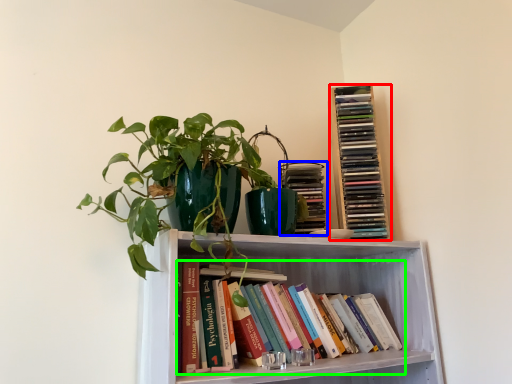
Question: Estimate the real-world distances between objects in this image. Which object is farther from book (highlighted by a red box), book (highlighted by a blue box) or book (highlighted by a green box)?

Choices:
 (A) book
 (B) book

Answer: (B)